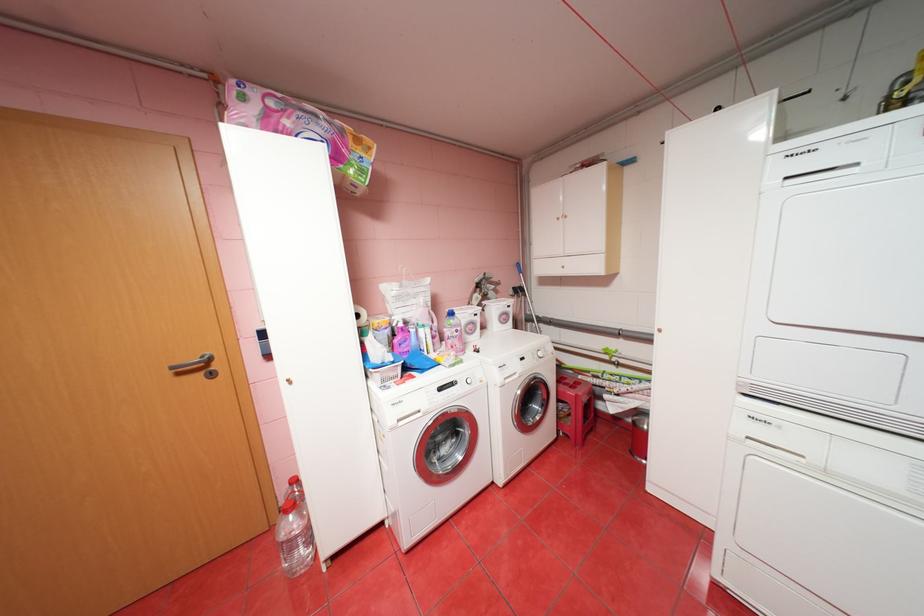
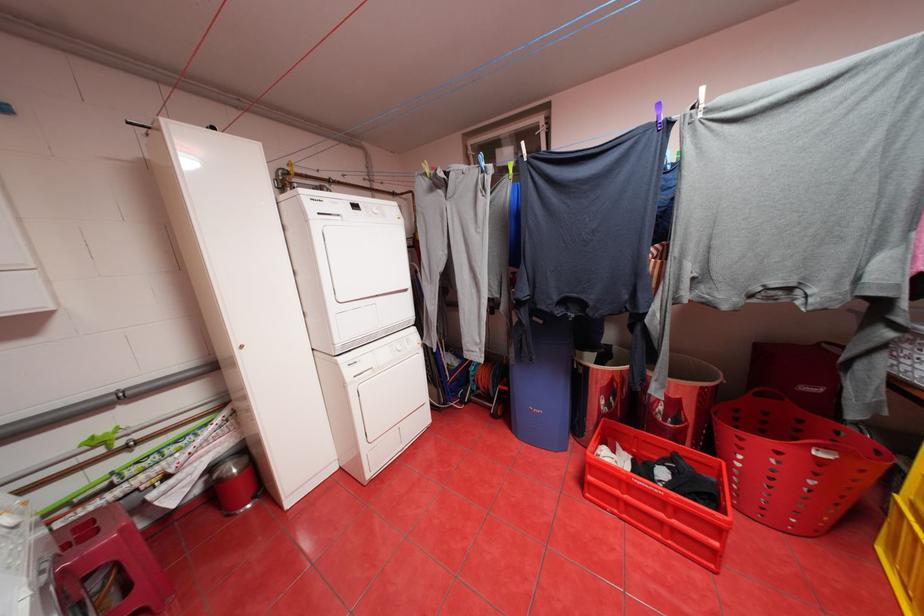
Find the pixel in the second image that matches the point at 585,395 in the first image.

(130, 530)